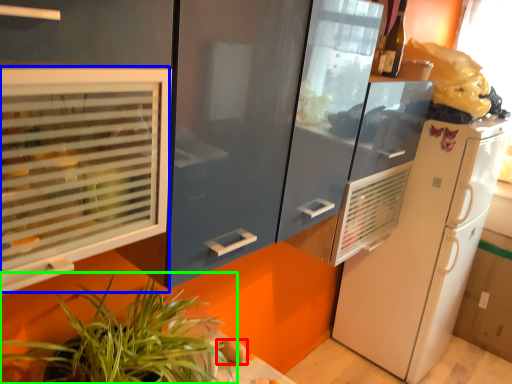
Question: Estimate the real-world distances between objects in this image. Which object is closer to food (highlighted by a red box), window (highlighted by a blue box) or houseplant (highlighted by a green box)?

Choices:
 (A) window
 (B) houseplant

Answer: (B)